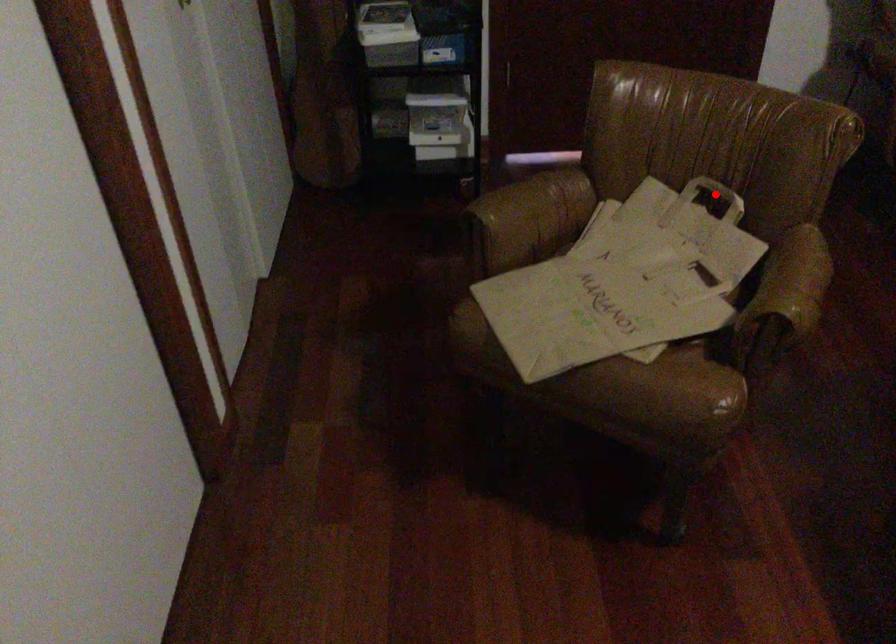
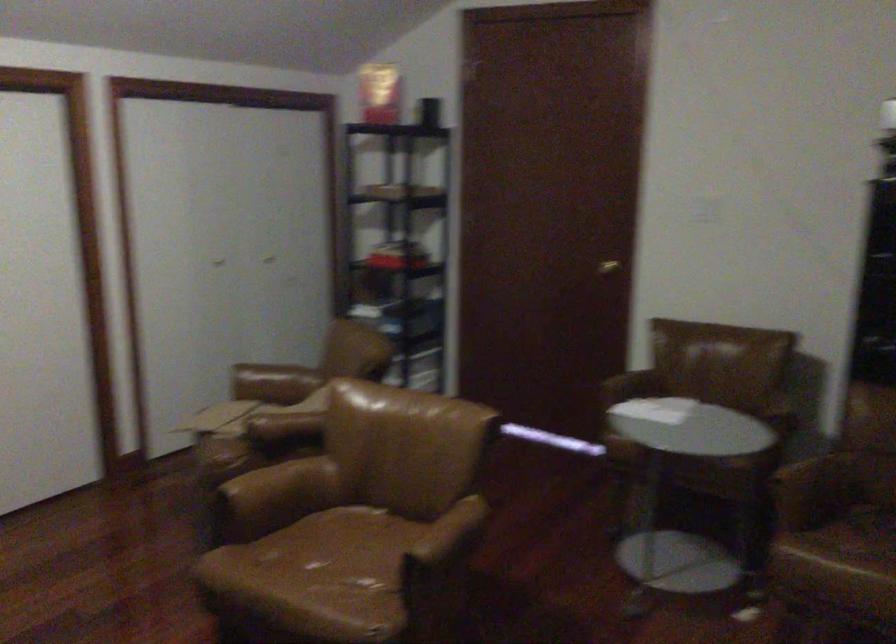
Question: I am providing you with two images of the same scene from different viewpoints. A red point is marked on the first image. Is the red point's position out of view in image 2?

Choices:
 (A) Yes
 (B) No

Answer: (A)